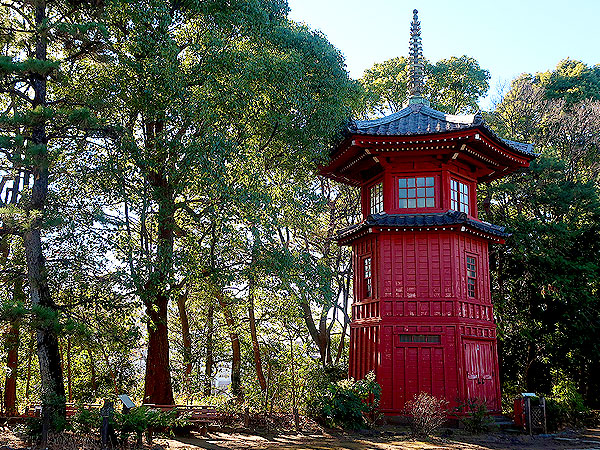
Identify the location of second floor window right. (468, 282).